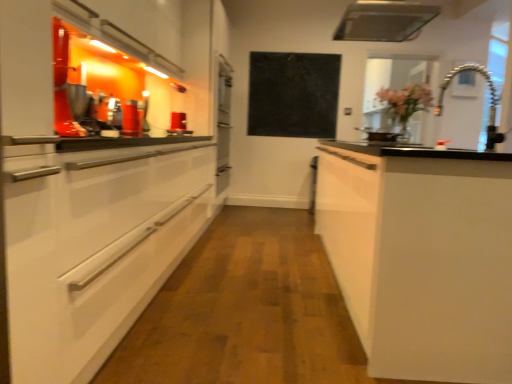
Question: Can flexible metallic faucet at upper right be found inside metallic silver exhaust hood at upper center?

Choices:
 (A) no
 (B) yes

Answer: (A)

Question: Can you confirm if metallic silver exhaust hood at upper center is wider than flexible metallic faucet at upper right?

Choices:
 (A) no
 (B) yes

Answer: (B)

Question: Is metallic silver exhaust hood at upper center closer to camera compared to flexible metallic faucet at upper right?

Choices:
 (A) no
 (B) yes

Answer: (A)

Question: From the image's perspective, is metallic silver exhaust hood at upper center beneath flexible metallic faucet at upper right?

Choices:
 (A) no
 (B) yes

Answer: (A)

Question: Could you tell me if metallic silver exhaust hood at upper center is facing flexible metallic faucet at upper right?

Choices:
 (A) yes
 (B) no

Answer: (B)

Question: Can you confirm if metallic silver exhaust hood at upper center is taller than flexible metallic faucet at upper right?

Choices:
 (A) yes
 (B) no

Answer: (A)

Question: Does white matte cabinet at right have a smaller size compared to transparent glass window at upper right?

Choices:
 (A) yes
 (B) no

Answer: (B)

Question: Considering the relative sizes of white matte cabinet at right and transparent glass window at upper right in the image provided, is white matte cabinet at right wider than transparent glass window at upper right?

Choices:
 (A) no
 (B) yes

Answer: (B)

Question: Is the position of white matte cabinet at right less distant than that of transparent glass window at upper right?

Choices:
 (A) no
 (B) yes

Answer: (B)

Question: Is white matte cabinet at right facing towards transparent glass window at upper right?

Choices:
 (A) yes
 (B) no

Answer: (B)

Question: From the image's perspective, is white matte cabinet at right located beneath transparent glass window at upper right?

Choices:
 (A) yes
 (B) no

Answer: (A)

Question: Is white matte cabinet at right looking in the opposite direction of transparent glass window at upper right?

Choices:
 (A) no
 (B) yes

Answer: (A)

Question: Can you confirm if flexible metallic faucet at upper right is thinner than white matte cabinet at right?

Choices:
 (A) no
 (B) yes

Answer: (B)